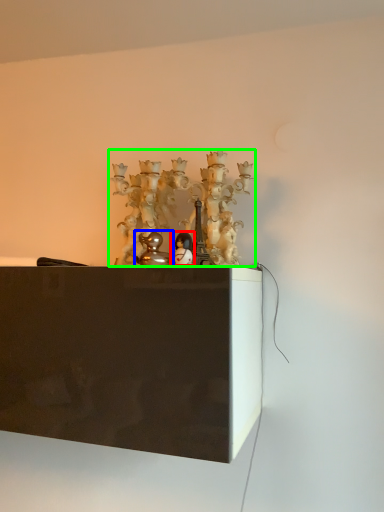
Question: Considering the real-world distances, which object is closest to toy (highlighted by a red box)? toy (highlighted by a blue box) or art (highlighted by a green box).

Choices:
 (A) toy
 (B) art

Answer: (A)